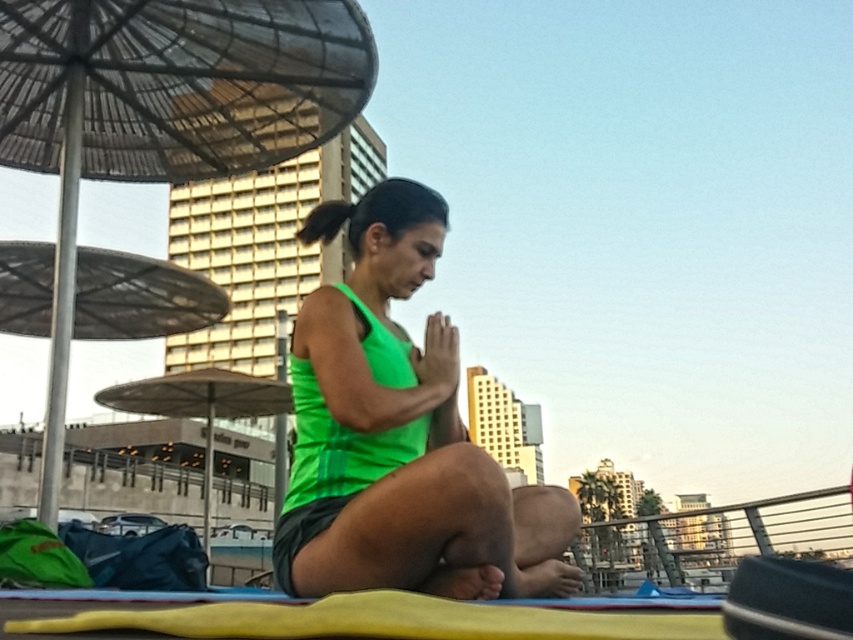
Is green matte tank top at center smaller than metallic umbrella at upper left?

No, green matte tank top at center is not smaller than metallic umbrella at upper left.

Which is above, green matte tank top at center or metallic umbrella at upper left?

metallic umbrella at upper left is higher up.

Which is behind, point (396, 435) or point (49, 83)?

The point (49, 83) is behind.

Locate an element on the screen. green matte tank top at center is located at coordinates (399, 435).